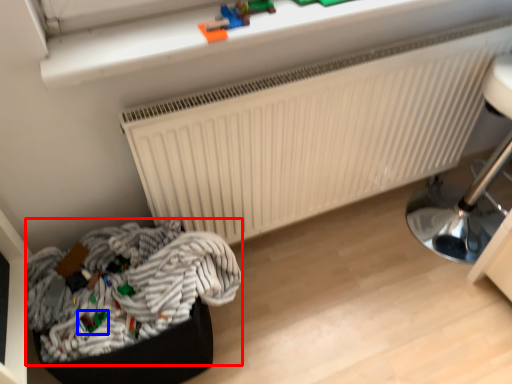
Question: Among these objects, which one is nearest to the camera, laundry (highlighted by a red box) or toy (highlighted by a blue box)?

Choices:
 (A) laundry
 (B) toy

Answer: (A)